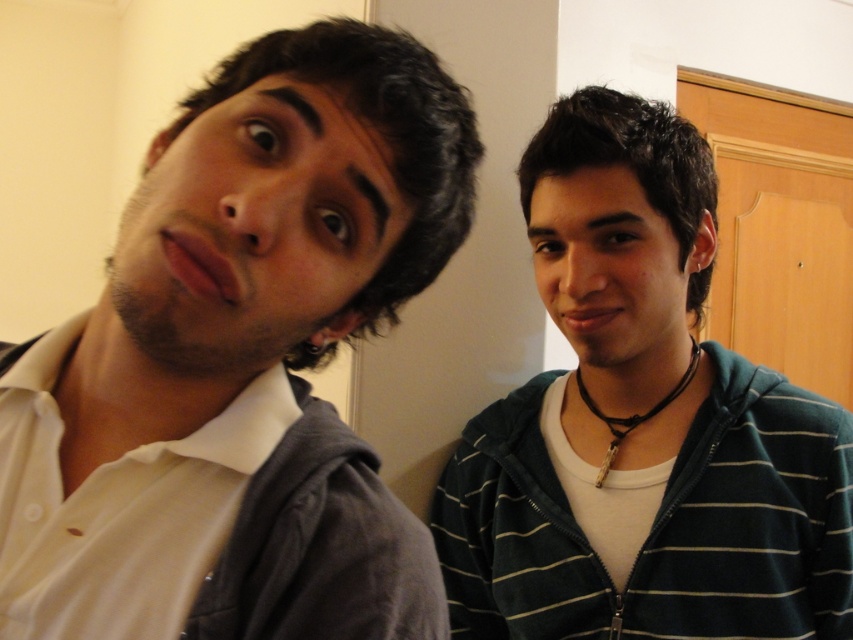
You are a photographer setting up a shoot in this room. You need to position a light source so that it illuminates the white matte shirt at left without casting a shadow on the striped hoodie at right. Based on their positions, where should you place the light source?

The white matte shirt at left is above striped hoodie at right. To avoid casting a shadow on the striped hoodie at right, the light source should be placed below the white matte shirt at left, facing upwards.

In the scene shown: You are organizing a clothing donation drive and need to categorize items based on their positions. If you have to place the white matte shirt at left and the striped hoodie at right into separate boxes labeled according to their original positions, which box should each go into?

The white matte shirt at left should be placed in the box labeled left, and the striped hoodie at right should be placed in the box labeled right.